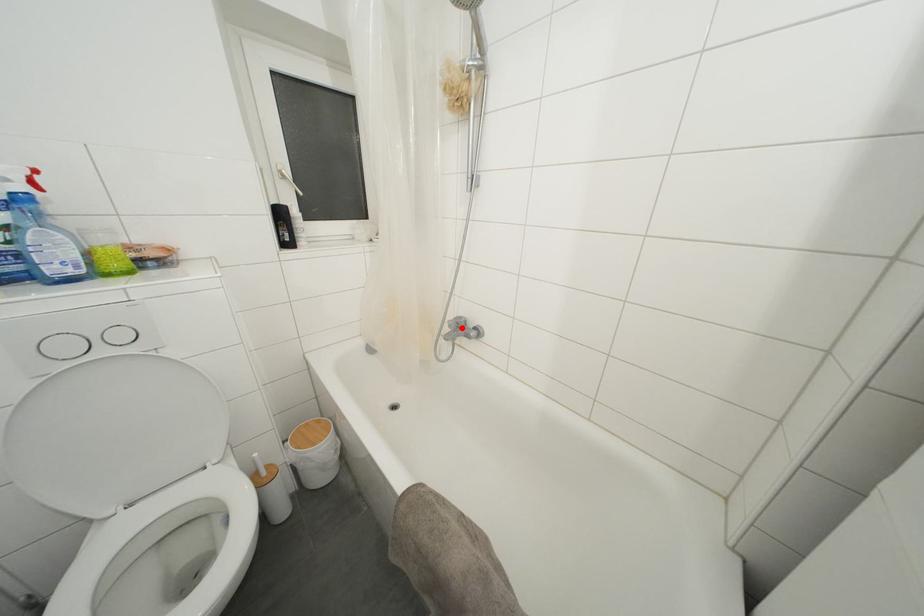
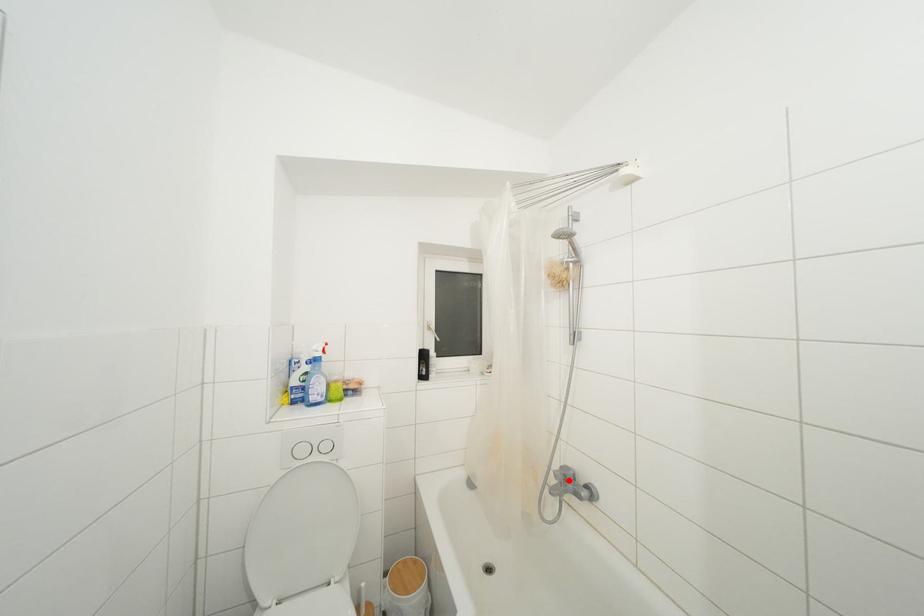
I am providing you with two images of the same scene from different viewpoints. A red point is marked on the first image and another point is marked on the second image. Is the red point in image1 aligned with the point shown in image2?

Yes